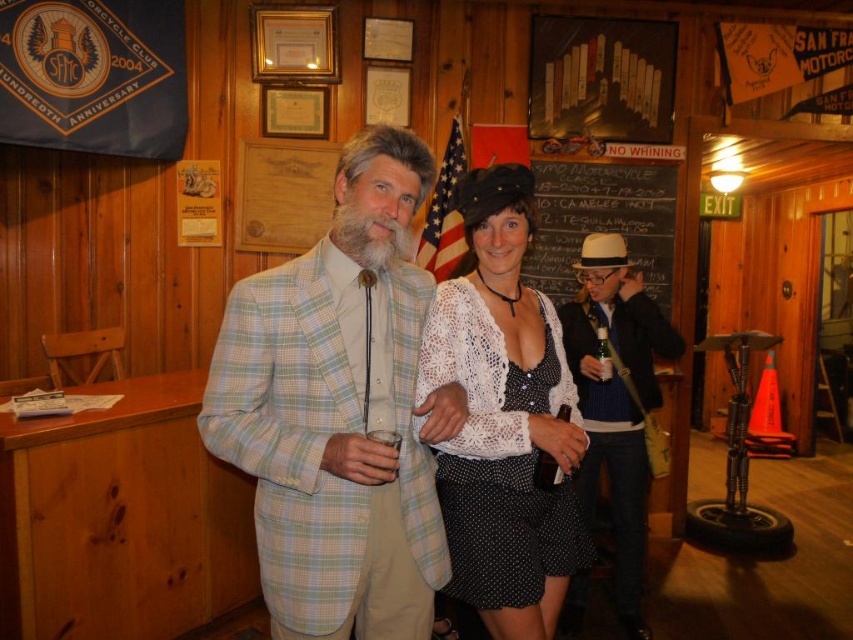
Who is shorter, light blue plaid suit at center or knitted sweater at center?

With less height is light blue plaid suit at center.

Does light blue plaid suit at center lie in front of knitted sweater at center?

Yes, light blue plaid suit at center is in front of knitted sweater at center.

The height and width of the screenshot is (640, 853). In order to click on light blue plaid suit at center in this screenshot , I will do `click(339, 410)`.

Can you confirm if knitted sweater at center is positioned to the right of black chalkboard at upper center?

Incorrect, knitted sweater at center is not on the right side of black chalkboard at upper center.

Is knitted sweater at center above black chalkboard at upper center?

No, knitted sweater at center is not above black chalkboard at upper center.

This screenshot has width=853, height=640. What do you see at coordinates (618, 403) in the screenshot?
I see `knitted sweater at center` at bounding box center [618, 403].

Locate an element on the screen. The width and height of the screenshot is (853, 640). knitted sweater at center is located at coordinates (618, 403).

Can you confirm if black dotted fabric dress at center is wider than knitted sweater at center?

No.

Describe the element at coordinates (498, 454) in the screenshot. The height and width of the screenshot is (640, 853). I see `black dotted fabric dress at center` at that location.

Is point (483, 502) positioned behind point (641, 333)?

No, (483, 502) is in front of (641, 333).

Where is `black dotted fabric dress at center`? The height and width of the screenshot is (640, 853). black dotted fabric dress at center is located at coordinates (x=498, y=454).